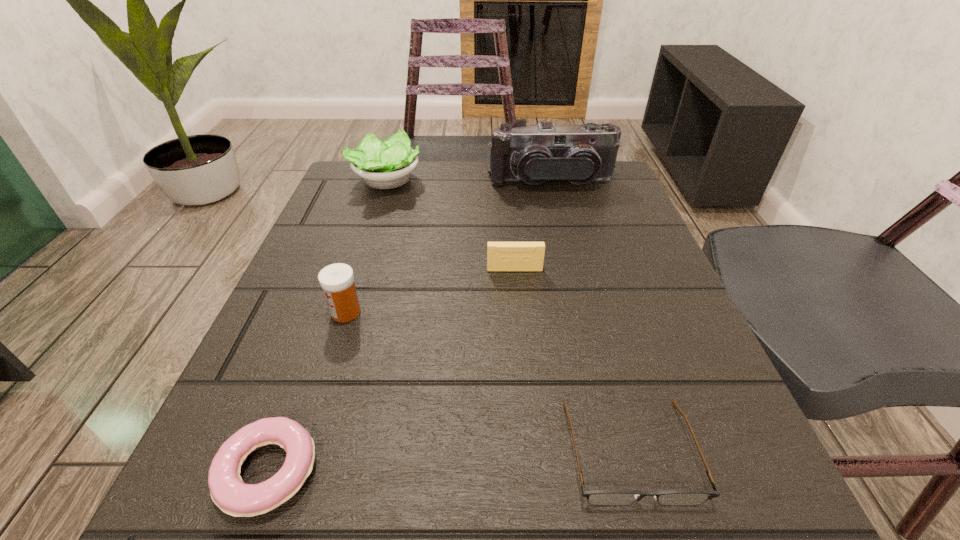
Locate an element on the screen. spectacles positioned at the right edge is located at coordinates coord(595,497).

Locate an element on the screen. object that is at the far left corner is located at coordinates (387, 164).

The width and height of the screenshot is (960, 540). In order to click on object that is at the near left corner in this screenshot , I will do pyautogui.click(x=234, y=497).

At what (x,y) coordinates should I click in order to perform the action: click on object that is at the far right corner. Please return your answer as a coordinate pair (x, y). The image size is (960, 540). Looking at the image, I should click on (545, 153).

I want to click on object that is at the near right corner, so click(x=595, y=497).

Where is `free location at the far edge of the desktop`? Image resolution: width=960 pixels, height=540 pixels. free location at the far edge of the desktop is located at coordinates (414, 209).

Where is `free space at the near edge of the desktop`? The image size is (960, 540). free space at the near edge of the desktop is located at coordinates (592, 532).

Where is `free location at the left edge`? The image size is (960, 540). free location at the left edge is located at coordinates (351, 332).

The height and width of the screenshot is (540, 960). In the image, there is a desktop. Identify the location of vacant space at the right edge. (632, 241).

Find the location of a particular element. The width and height of the screenshot is (960, 540). vacant space at the far left corner of the desktop is located at coordinates (394, 188).